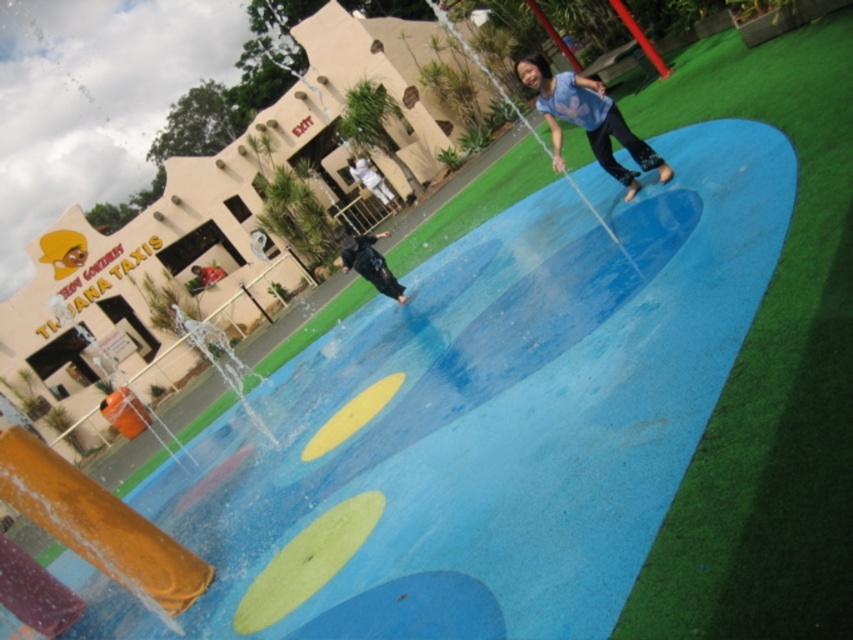
You are a photographer standing at the edge of the water feature. You want to take a photo that includes both the black matte pants at center and the dark blue fabric shirt at center. What is the minimum distance you need to move backward to ensure both objects are in frame?

The black matte pants at center and the dark blue fabric shirt at center are 11.06 meters apart. To ensure both are in frame, you need to move backward until your camera can capture a field of view that encompasses 11.06 meters between them.

You are a photographer trying to capture a photo of the blue matte shirt at upper center and the black matte pants at center. Which object is located to the right of the other?

The blue matte shirt at upper center is positioned on the right side of black matte pants at center.